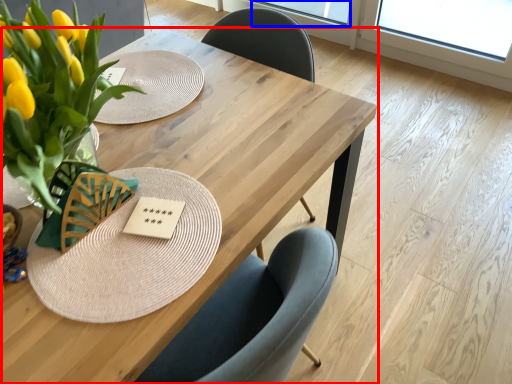
Question: Which of the following is the farthest to the observer, table (highlighted by a red box) or window screen (highlighted by a blue box)?

Choices:
 (A) table
 (B) window screen

Answer: (B)